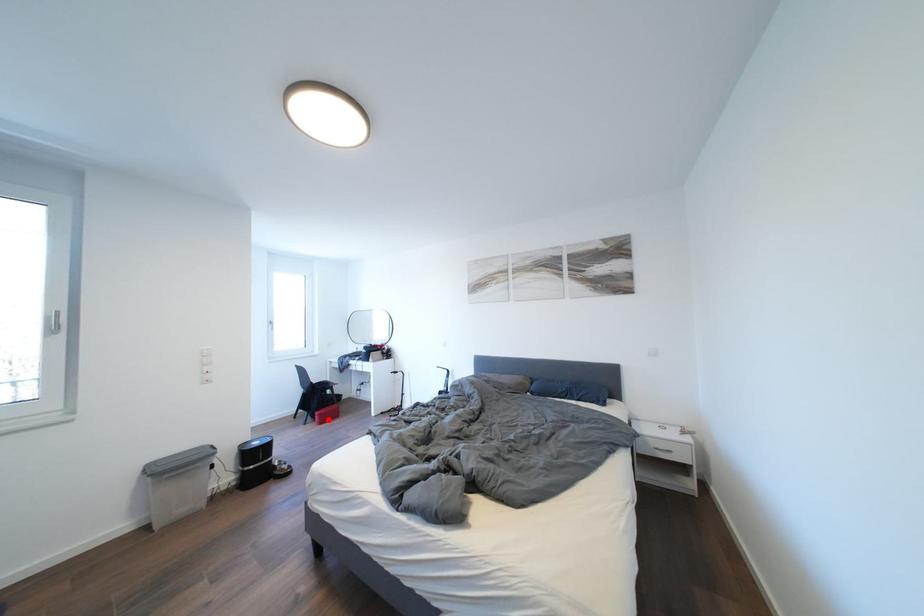
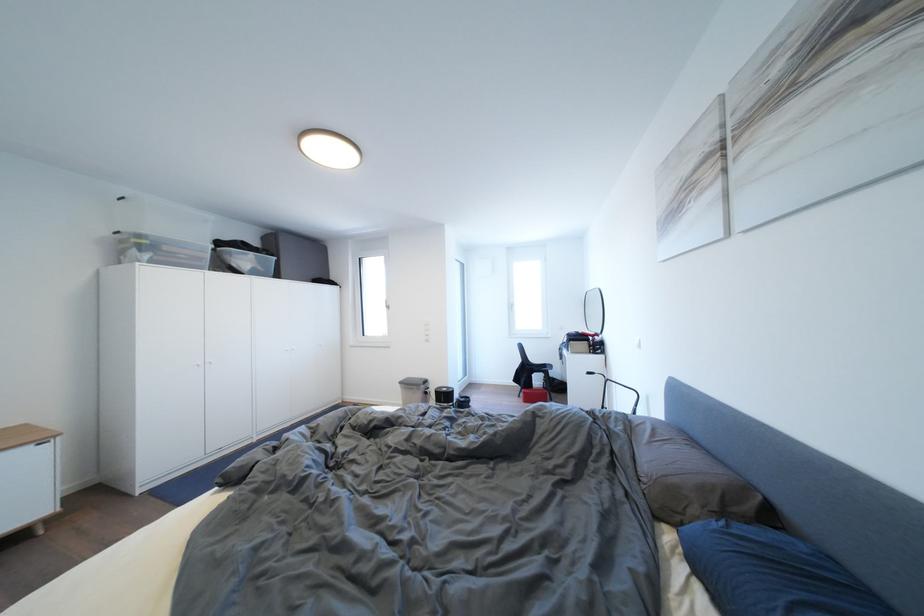
The point at the highlighted location is marked in the first image. Where is the corresponding point in the second image?

(532, 398)